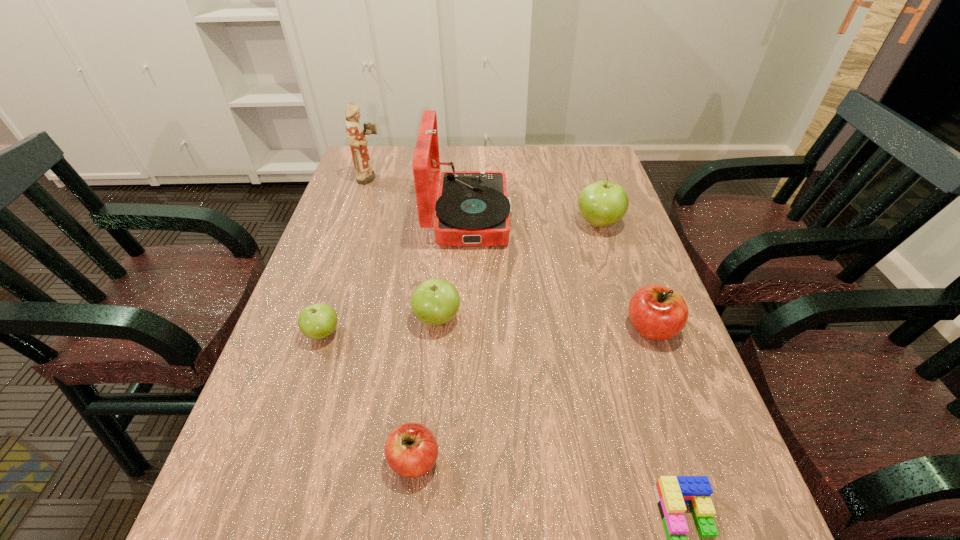
What are the coordinates of `vacant point that satisfies the following two spatial constraints: 1. on the back side of the left red apple; 2. on the right side of the second smallest green apple` in the screenshot? It's located at (429, 318).

What are the coordinates of `free space that satisfies the following two spatial constraints: 1. on the back side of the bigger red apple; 2. on the front-facing side of the figurine` in the screenshot? It's located at (598, 179).

Locate an element on the screen. This screenshot has height=540, width=960. free space that satisfies the following two spatial constraints: 1. on the front-facing side of the figurine; 2. on the right side of the nearer red apple is located at coordinates (277, 460).

I want to click on free space that satisfies the following two spatial constraints: 1. on the front-facing side of the farthest object; 2. on the back side of the farther red apple, so click(322, 328).